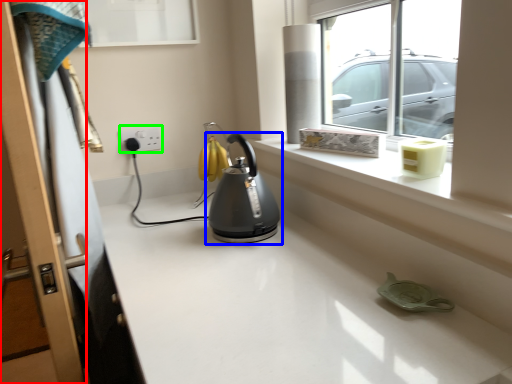
Question: Estimate the real-world distances between objects in this image. Which object is closer to screen door (highlighted by a red box), kettle (highlighted by a blue box) or electric outlet (highlighted by a green box)?

Choices:
 (A) kettle
 (B) electric outlet

Answer: (A)